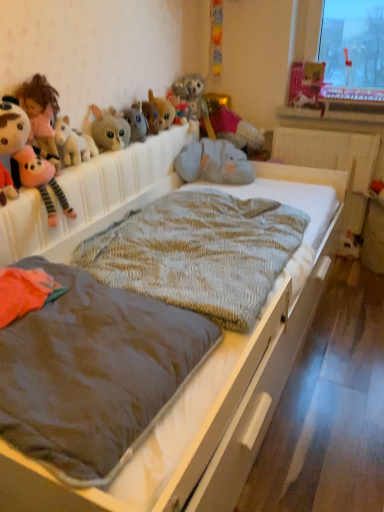
Find the location of a particular element. This screenshot has height=512, width=384. vacant point above white plastic window sill at upper center (from a real-world perspective) is located at coordinates (332, 110).